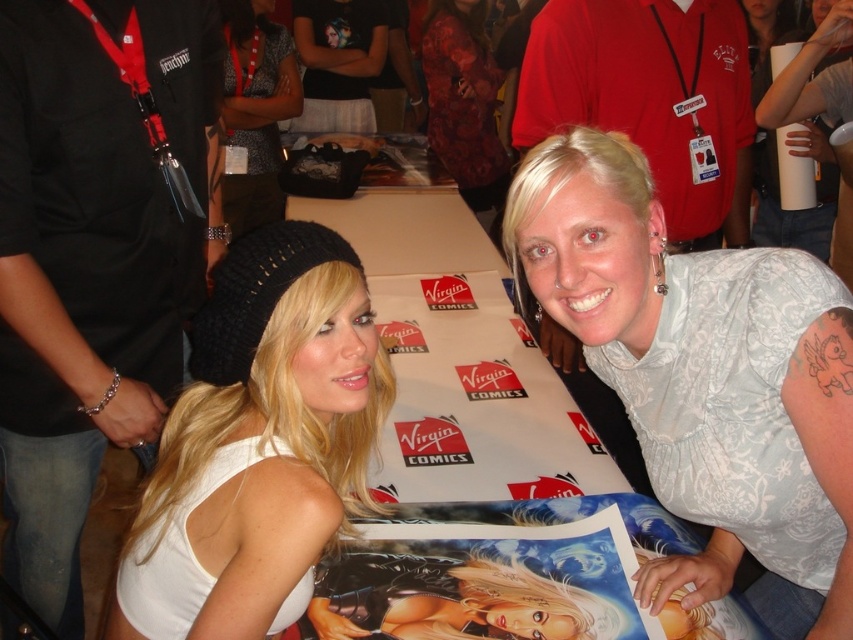
Question: Based on their relative distances, which object is nearer to the black knit beanie at upper left?

Choices:
 (A) white knit beanie at upper left
 (B) white lace blouse at center

Answer: (A)

Question: Does black knit beanie at upper left appear on the left side of floral fabric dress at center?

Choices:
 (A) yes
 (B) no

Answer: (A)

Question: Can you confirm if white lace blouse at center is positioned below black knit beanie at upper left?

Choices:
 (A) no
 (B) yes

Answer: (B)

Question: Which of the following is the farthest from the observer?

Choices:
 (A) floral fabric dress at center
 (B) white knit beanie at upper left
 (C) black knit beanie at upper left
 (D) white lace blouse at center

Answer: (A)

Question: Is white lace blouse at center closer to camera compared to white knit beanie at upper left?

Choices:
 (A) no
 (B) yes

Answer: (A)

Question: Which of these objects is positioned closest to the floral fabric dress at center?

Choices:
 (A) black knit beanie at upper left
 (B) white lace blouse at center

Answer: (A)